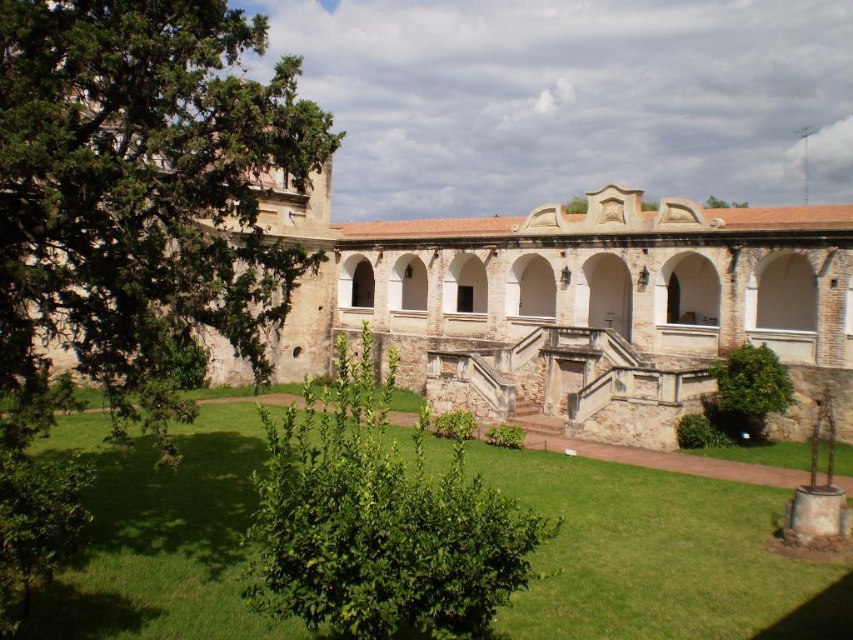
You are planning to place a picnic blanket in the courtyard. The green leafy bush at center and the green leafy tree at lower right are both in the area. Which of these two plants has a larger width, making it a better spot to avoid for placing the blanket?

The green leafy bush at center might be wider than green leafy tree at lower right, so it could be a better spot to avoid for placing the picnic blanket to ensure enough space.

You are planning to place a picnic blanket in the courtyard. The brown stone building at center and the green grass at center are both in your view. Which area is larger in size so that the blanket can be placed there comfortably?

The brown stone building at center is bigger than the green grass at center, so the picnic blanket can be placed comfortably on the brown stone building at center.

You are standing in the courtyard and want to take a photo that includes both the point at coordinates (219, 221) and the point at (288, 458). Which point should you position closer to the camera to ensure both are in the frame?

Since point (219, 221) is behind point (288, 458), you should position the camera closer to point (288, 458) to ensure both points are visible in the frame without one blocking the other.